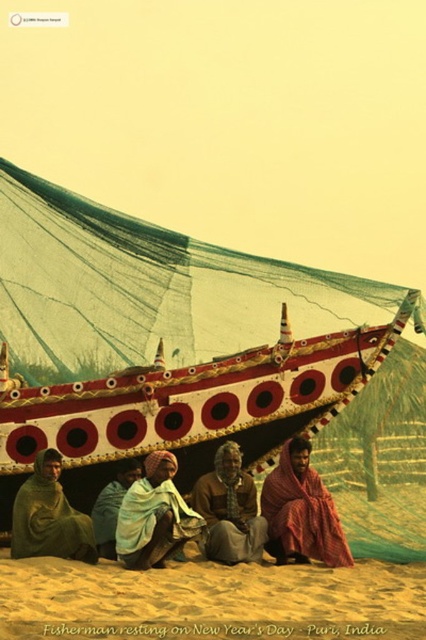
How distant is reddish-brown painted wooden boat at center from blue fabric cloth at lower center?

reddish-brown painted wooden boat at center and blue fabric cloth at lower center are 59.81 feet apart from each other.

Who is more forward, (147, 285) or (103, 538)?

Point (103, 538)

What do you see at coordinates (161, 333) in the screenshot? I see `reddish-brown painted wooden boat at center` at bounding box center [161, 333].

The width and height of the screenshot is (426, 640). Identify the location of reddish-brown painted wooden boat at center. (161, 333).

Is sandy yellow sand at lower center positioned at the back of white cotton shawl at lower center?

That is False.

Between point (109, 582) and point (164, 454), which one is positioned behind?

The point (164, 454) is more distant.

Between point (222, 576) and point (163, 522), which one is positioned behind?

Positioned behind is point (163, 522).

Locate an element on the screen. sandy yellow sand at lower center is located at coordinates (210, 595).

Who is higher up, red woven cloth at lower right or green woolen shawl at lower left?

red woven cloth at lower right

Describe the element at coordinates (301, 509) in the screenshot. The width and height of the screenshot is (426, 640). I see `red woven cloth at lower right` at that location.

Identify the location of red woven cloth at lower right. This screenshot has height=640, width=426. (301, 509).